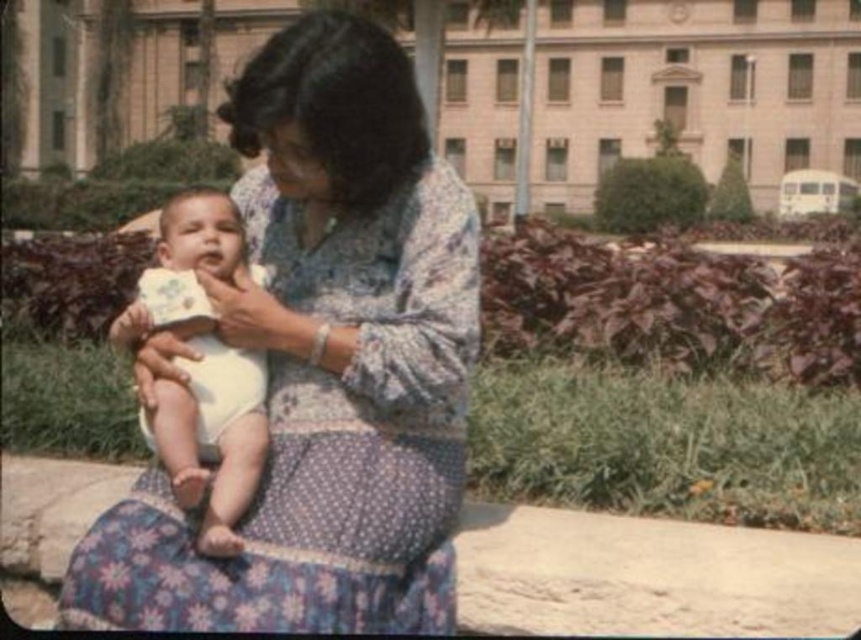
You are a photographer trying to capture a closeup of the baby in the image. You have two points marked on your viewfinder at point (364, 324) and point (237, 497). Which point should you focus on to ensure the baby is in focus?

You should focus on point (364, 324) because it is closer to the camera than point (237, 497), which will keep the baby in focus.

You are a photographer trying to capture a closeup of the floral fabric dress at center and the white clothed baby at center. Since you want both subjects to be clearly visible, which one should you zoom in on more?

The floral fabric dress at center is smaller than the white clothed baby at center, so you should zoom in more on the floral fabric dress at center to ensure it appears larger and clearer in the photo.